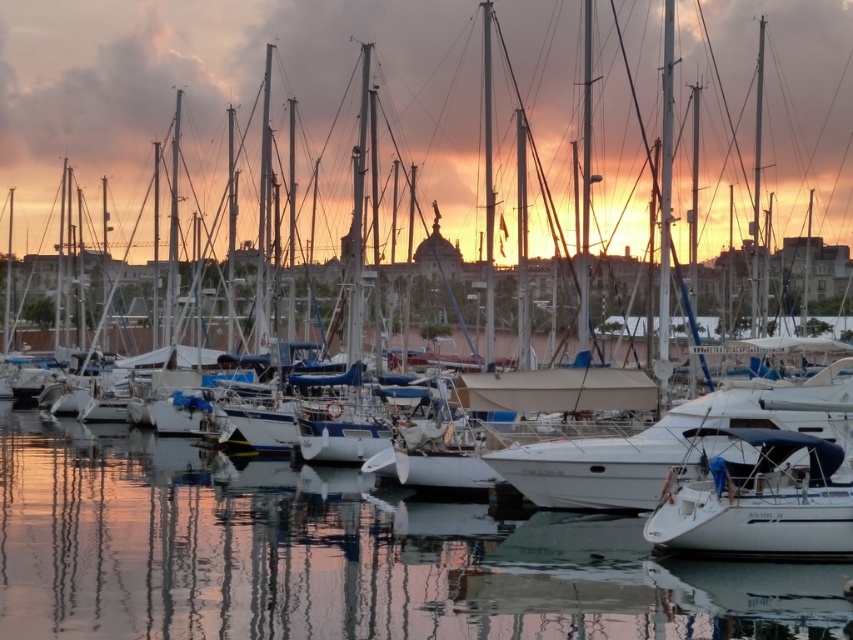
Question: Can you confirm if clear water at center is wider than white matte sailboat at lower right?

Choices:
 (A) yes
 (B) no

Answer: (A)

Question: Which point is farther to the camera?

Choices:
 (A) (700, 458)
 (B) (136, 477)

Answer: (B)

Question: Which of the following is the farthest from the observer?

Choices:
 (A) (706, 512)
 (B) (263, 506)

Answer: (B)

Question: Considering the relative positions of clear water at center and white matte sailboat at lower right in the image provided, where is clear water at center located with respect to white matte sailboat at lower right?

Choices:
 (A) above
 (B) below

Answer: (B)

Question: Can you confirm if clear water at center is positioned to the left of white matte sailboat at lower right?

Choices:
 (A) yes
 (B) no

Answer: (A)